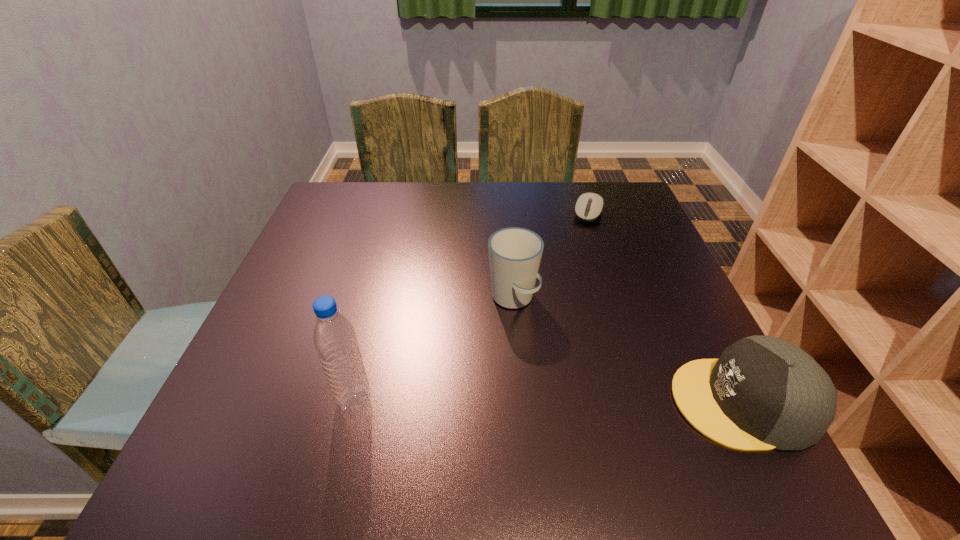
Where is `water bottle`? water bottle is located at coordinates (334, 338).

Locate an element on the screen. The width and height of the screenshot is (960, 540). the leftmost object is located at coordinates (334, 338).

You are a GUI agent. You are given a task and a screenshot of the screen. Output one action in this format:
    pyautogui.click(x=<x>, y=<y>)
    Task: Click on the cap
    
    Given the screenshot: What is the action you would take?
    pyautogui.click(x=763, y=392)

You are a GUI agent. You are given a task and a screenshot of the screen. Output one action in this format:
    pyautogui.click(x=<x>, y=<y>)
    Task: Click on the third shortest object
    
    Given the screenshot: What is the action you would take?
    pyautogui.click(x=515, y=253)

Where is `the second object from left to right`? This screenshot has width=960, height=540. the second object from left to right is located at coordinates (515, 253).

Image resolution: width=960 pixels, height=540 pixels. I want to click on the farthest object, so click(589, 206).

Find the location of `the shortest object`. the shortest object is located at coordinates (589, 206).

At what (x,y) coordinates should I click in order to perform the action: click on vacant space located 0.120m on the right of the tallest object. Please return your answer as a coordinate pair (x, y). This screenshot has width=960, height=540. Looking at the image, I should click on (442, 401).

This screenshot has height=540, width=960. What are the coordinates of `free spot located 0.280m on the front-facing side of the cap` in the screenshot? It's located at (513, 402).

Identify the location of free region located on the front-facing side of the cap. This screenshot has height=540, width=960. (530, 402).